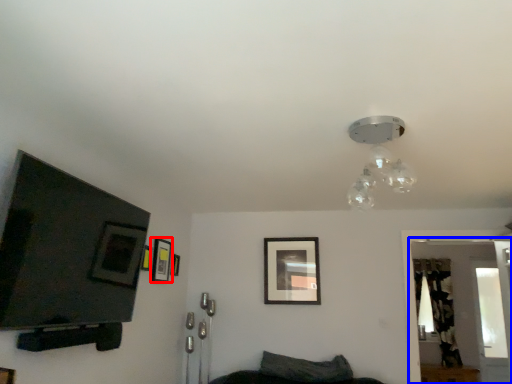
Question: Among these objects, which one is farthest to the camera, picture frame (highlighted by a red box) or glass door (highlighted by a blue box)?

Choices:
 (A) picture frame
 (B) glass door

Answer: (B)